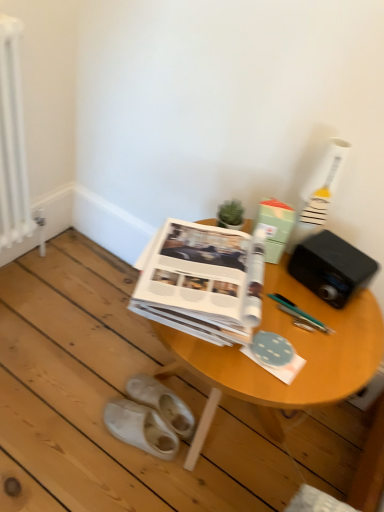
Question: Is green matte paper at center, the first paperback book from the right, inside the boundaries of black plastic speaker at upper right, or outside?

Choices:
 (A) inside
 (B) outside

Answer: (B)

Question: Based on their sizes in the image, would you say green matte paper at center, the first paperback book from the right, is bigger or smaller than black plastic speaker at upper right?

Choices:
 (A) small
 (B) big

Answer: (A)

Question: Which object is the farthest from the white metallic radiator at left?

Choices:
 (A) black plastic speaker at upper right
 (B) wooden table at center
 (C) white fabric slippers at lower left, the 2th footwear when ordered from back to front
 (D) white suede slippers at lower left, acting as the second footwear starting from the front
 (E) white paper at center, which appears as the second paperback book when viewed from the right

Answer: (A)

Question: Estimate the real-world distances between objects in this image. Which object is closer to the white paper at center, marked as the 1th paperback book in a left-to-right arrangement?

Choices:
 (A) white fabric slippers at lower left, the 2th footwear when ordered from back to front
 (B) black plastic speaker at upper right
 (C) white metallic radiator at left
 (D) green matte paper at center, the first paperback book from the right
 (E) wooden table at center

Answer: (E)